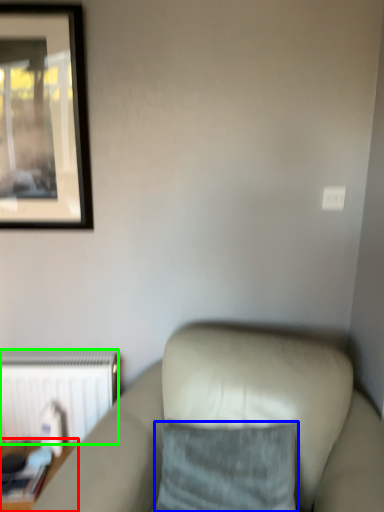
Question: Based on their relative distances, which object is nearer to table (highlighted by a red box)? Choose from pillow (highlighted by a blue box) and radiator (highlighted by a green box).

Choices:
 (A) pillow
 (B) radiator

Answer: (B)